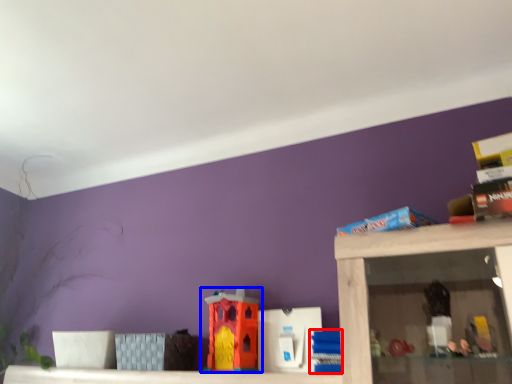
Question: Which point is closer to the camera, toy (highlighted by a red box) or toy (highlighted by a blue box)?

Choices:
 (A) toy
 (B) toy

Answer: (A)